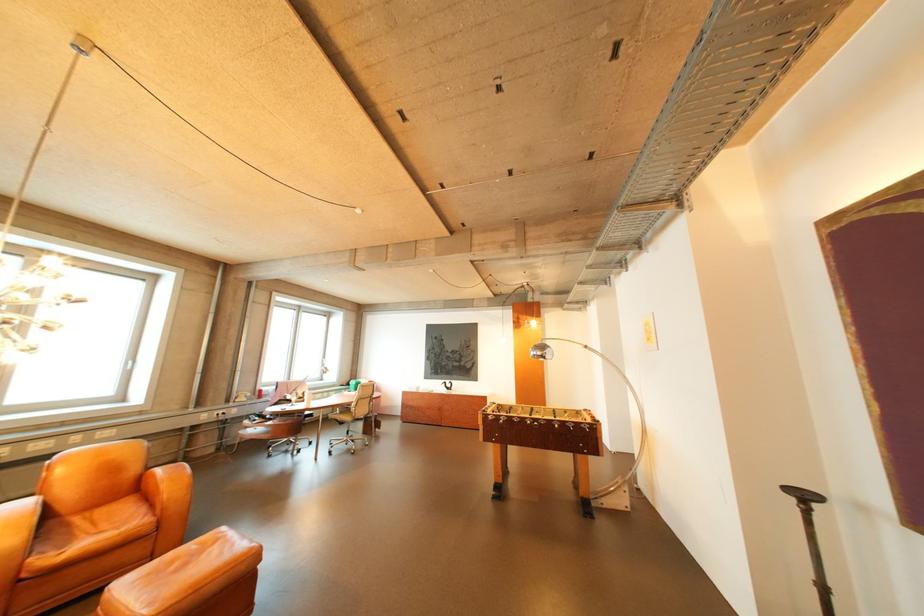
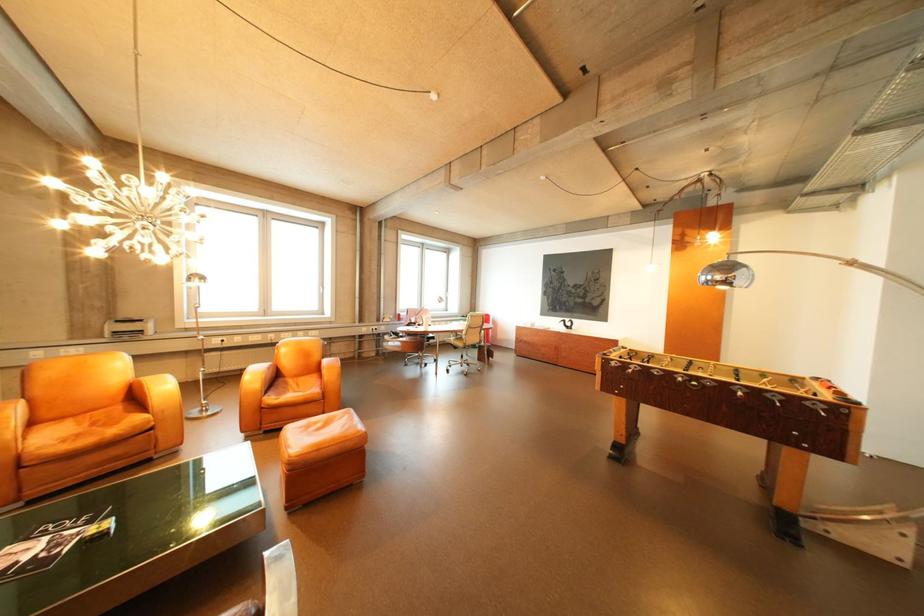
Question: The first image is from the beginning of the video and the second image is from the end. How did the camera likely rotate when shooting the video?

Choices:
 (A) Left
 (B) Right
 (C) Up
 (D) Down

Answer: (A)